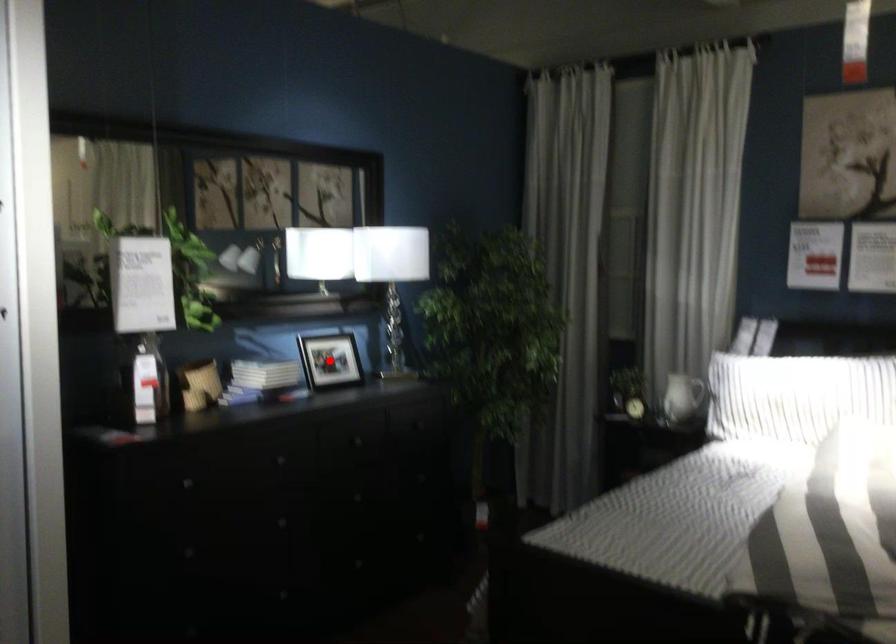
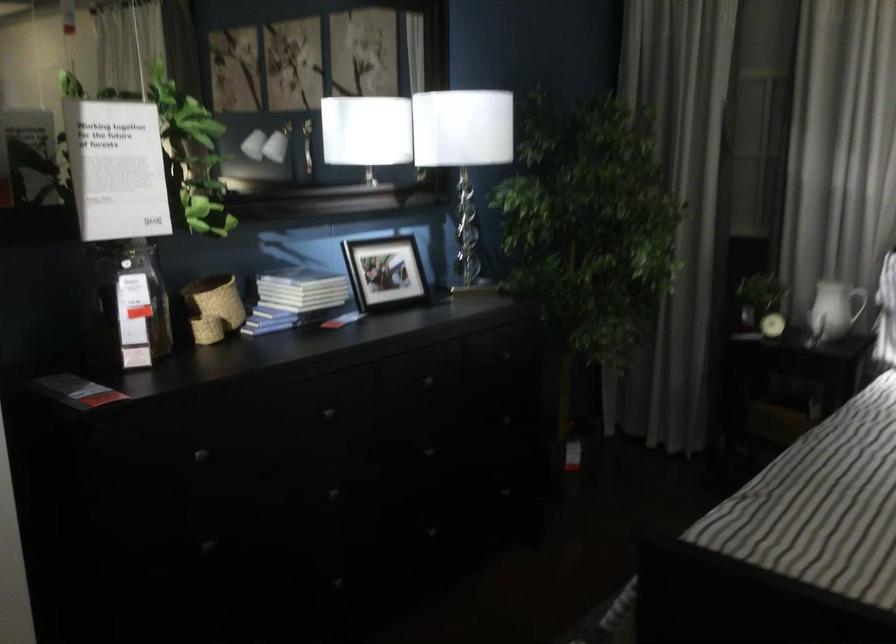
Find the pixel in the second image that matches the highlighted location in the first image.

(384, 272)